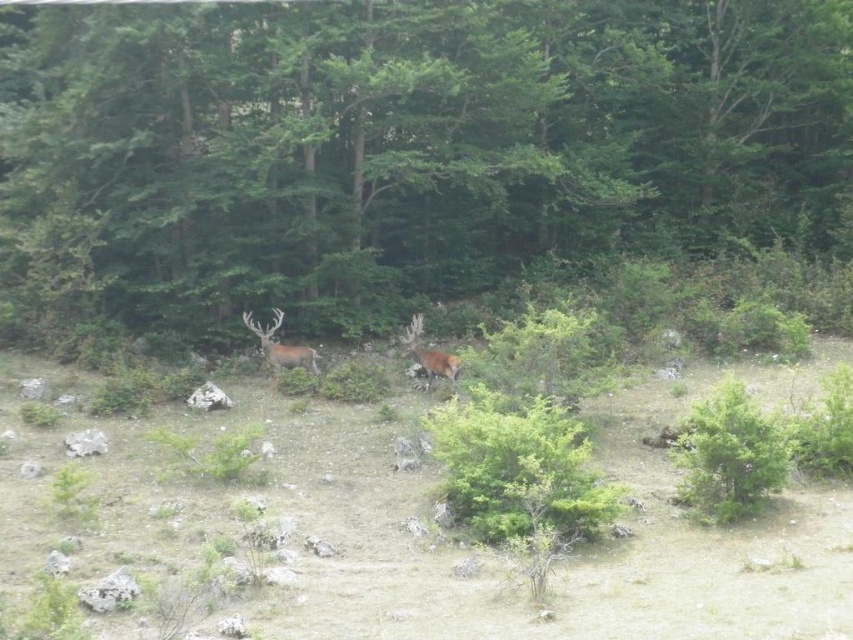
You are a hiker who wants to take a photo of the green leafy tree at center. You have a camera with a zoom lens that can focus on objects within a 0.5 meter radius. If you are standing at point 0.3 meters away from the tree, will you be able to capture the entire tree in your photo?

The green leafy tree at center is located at point [407,145]. Since you are standing 0.3 meters away from the tree, which is within the camera lens range of 0.5 meters, you can capture the entire tree in your photo.

You are a photographer trying to capture a photo of the two deer in the scene. You notice two points marked in the image, point 1 at coordinates point (372, 42) and point 2 at coordinates point (404, 342). Which point is closer to your camera lens?

Point (372, 42) is closer to the camera lens than point (404, 342).